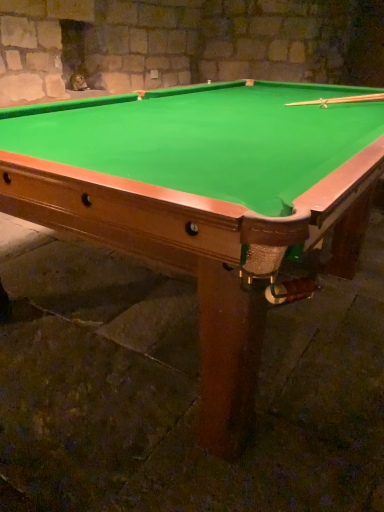
Question: Considering the positions of wooden cue at upper right and green felt pool table at center in the image, is wooden cue at upper right wider or thinner than green felt pool table at center?

Choices:
 (A) wide
 (B) thin

Answer: (B)

Question: Considering the positions of point (326, 104) and point (264, 152), is point (326, 104) closer or farther from the camera than point (264, 152)?

Choices:
 (A) closer
 (B) farther

Answer: (B)

Question: Is wooden cue at upper right in front of or behind green felt pool table at center in the image?

Choices:
 (A) front
 (B) behind

Answer: (B)

Question: From their relative heights in the image, would you say green felt pool table at center is taller or shorter than wooden cue at upper right?

Choices:
 (A) short
 (B) tall

Answer: (B)

Question: Is green felt pool table at center wider or thinner than wooden cue at upper right?

Choices:
 (A) thin
 (B) wide

Answer: (B)

Question: Considering the positions of point (213, 238) and point (304, 100), is point (213, 238) closer or farther from the camera than point (304, 100)?

Choices:
 (A) farther
 (B) closer

Answer: (B)

Question: Is green felt pool table at center inside the boundaries of wooden cue at upper right, or outside?

Choices:
 (A) inside
 (B) outside

Answer: (B)